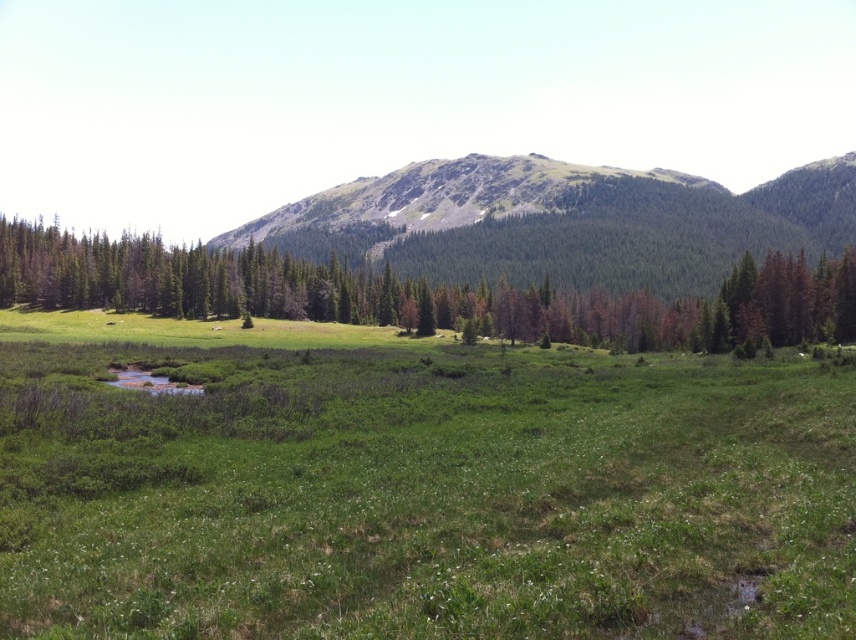
Can you confirm if rocky mountain at center is bigger than green leafy tree at center?

Indeed, rocky mountain at center has a larger size compared to green leafy tree at center.

Consider the image. Is rocky mountain at center taller than green leafy tree at center?

Yes, rocky mountain at center is taller than green leafy tree at center.

Find the location of `rocky mountain at center`. rocky mountain at center is located at coordinates (563, 221).